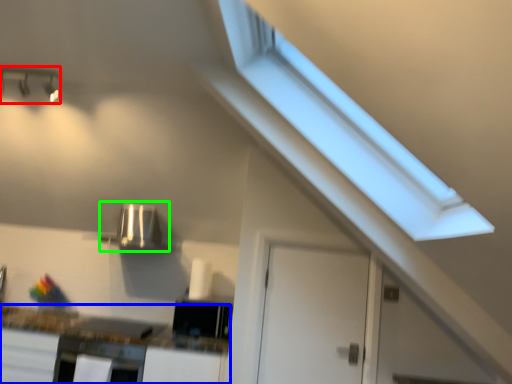
Question: Considering the real-world distances, which object is closest to light fixture (highlighted by a red box)? countertop (highlighted by a blue box) or appliance (highlighted by a green box).

Choices:
 (A) countertop
 (B) appliance

Answer: (B)